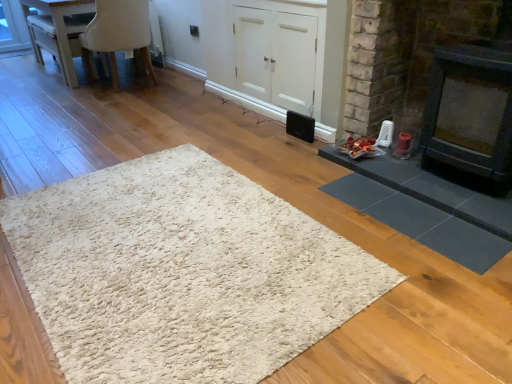
Question: In the image, is white shaggy rug at center, the 1th mat when ordered from left to right, positioned in front of or behind dark gray stone fireplace at right, which appears as the 2th fireplace when viewed from the right?

Choices:
 (A) behind
 (B) front

Answer: (B)

Question: In the image, is white shaggy rug at center, the 1th mat when ordered from left to right, on the left side or the right side of dark gray stone fireplace at right, which appears as the 2th fireplace when viewed from the right?

Choices:
 (A) right
 (B) left

Answer: (B)

Question: Which object is the farthest from the black matte speaker at center?

Choices:
 (A) white matte cabinet at center
 (B) dark gray rubber mat at lower right, arranged as the 2th mat when viewed from the left
 (C) white shaggy rug at center, the 1th mat when ordered from left to right
 (D) beige fabric chair at upper left
 (E) black matte fireplace at right, the second fireplace positioned from the left

Answer: (D)

Question: Estimate the real-world distances between objects in this image. Which object is farther from the black matte fireplace at right, the first fireplace when ordered from right to left?

Choices:
 (A) dark gray rubber mat at lower right, which is the 1th mat in right-to-left order
 (B) white glossy table at upper left
 (C) white shaggy rug at center, the 1th mat when ordered from left to right
 (D) beige fabric chair at upper left
 (E) black matte speaker at center

Answer: (B)